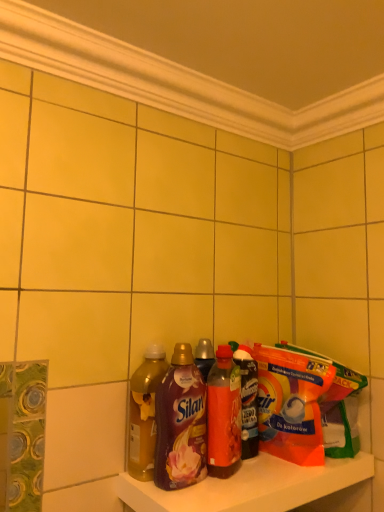
What are the coordinates of `vacant space to the right of matte plastic bottle at center, placed as the 3th bottle when sorted from right to left` in the screenshot? It's located at tap(245, 483).